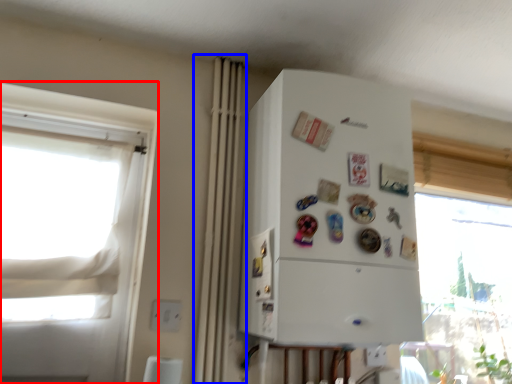
Question: Which of the following is the closest to the observer, window (highlighted by a red box) or curtain (highlighted by a blue box)?

Choices:
 (A) window
 (B) curtain

Answer: (A)